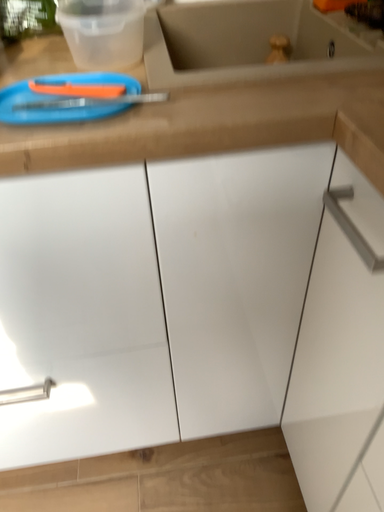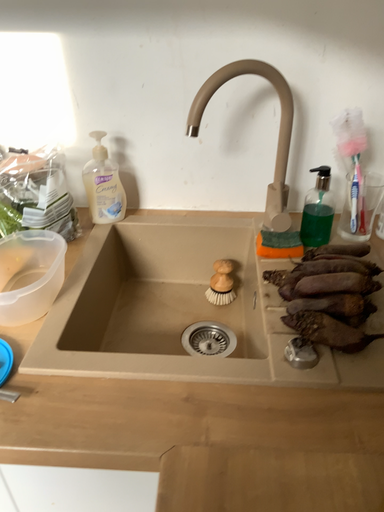
Question: Which way did the camera rotate in the video?

Choices:
 (A) rotated left
 (B) rotated right

Answer: (A)